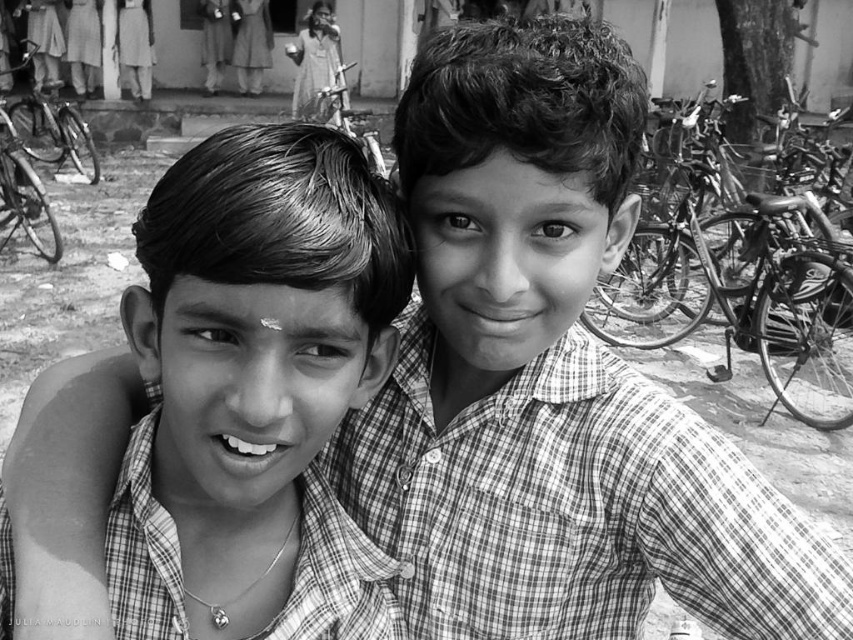
What are the coordinates of the checkered fabric shirt at center in the image?

The checkered fabric shirt at center is located at coordinates point [251,378].

You are a photographer trying to focus on the checkered fabric shirt at center and the metallic silver bicycle at right in the image. Which object is positioned lower in the frame?

The checkered fabric shirt at center is positioned below the metallic silver bicycle at right, so it is lower in the frame.